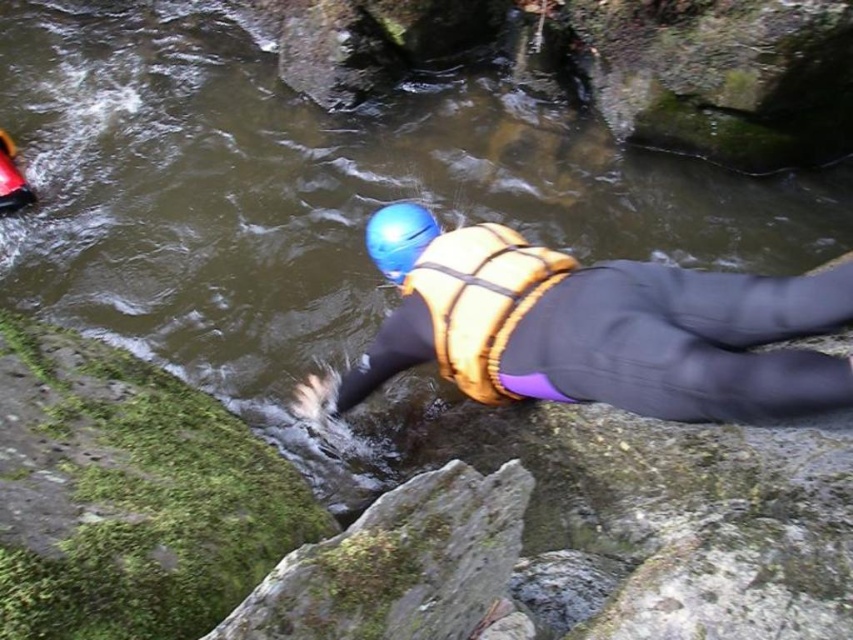
Which is above, matte yellow life vest at center or blue matte helmet at center?

blue matte helmet at center is above.

Is point (663, 326) closer to viewer compared to point (392, 205)?

Yes, it is in front of point (392, 205).

At what (x,y) coordinates should I click in order to perform the action: click on matte yellow life vest at center. Please return your answer as a coordinate pair (x, y). Looking at the image, I should click on (595, 330).

Image resolution: width=853 pixels, height=640 pixels. Describe the element at coordinates (595, 330) in the screenshot. I see `matte yellow life vest at center` at that location.

Does matte yellow life vest at center have a smaller size compared to yellow textured safety vest at center?

No.

The height and width of the screenshot is (640, 853). Find the location of `matte yellow life vest at center`. matte yellow life vest at center is located at coordinates (595, 330).

Is yellow textured safety vest at center below blue matte helmet at center?

Correct, yellow textured safety vest at center is located below blue matte helmet at center.

Does point (476, 262) lie behind point (410, 204)?

No.

The height and width of the screenshot is (640, 853). Find the location of `yellow textured safety vest at center`. yellow textured safety vest at center is located at coordinates (480, 300).